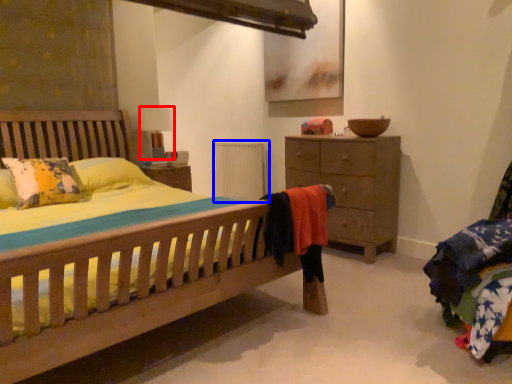
Question: Which point is further to the camera, table lamp (highlighted by a red box) or radiator (highlighted by a blue box)?

Choices:
 (A) table lamp
 (B) radiator

Answer: (B)